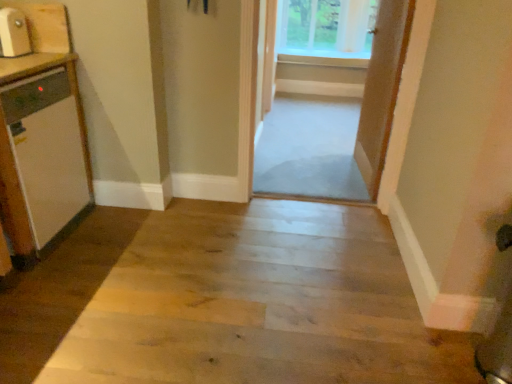
What do you see at coordinates (13, 33) in the screenshot? The width and height of the screenshot is (512, 384). I see `matte wood microwave at left, which appears as the 2th appliance when ordered from the bottom` at bounding box center [13, 33].

Identify the location of wooden floor at center. This screenshot has width=512, height=384. (259, 304).

What do you see at coordinates (259, 304) in the screenshot? This screenshot has height=384, width=512. I see `wooden floor at center` at bounding box center [259, 304].

The width and height of the screenshot is (512, 384). I want to click on wooden door at center, which is counted as the 2th door, starting from the right, so click(x=269, y=57).

Measure the distance between wooden door at center, arranged as the 1th door when viewed from the front, and camera.

wooden door at center, arranged as the 1th door when viewed from the front, and camera are 7.50 feet apart from each other.

At what (x,y) coordinates should I click in order to perform the action: click on clear glass window at upper center. Please return your answer as a coordinate pair (x, y). Looking at the image, I should click on point(326,30).

At what (x,y) coordinates should I click in order to perform the action: click on clear glass screen door at center. Please return your answer as a coordinate pair (x, y). Looking at the image, I should click on (334, 115).

Would you say wooden floor at center is a long distance from matte wood microwave at left, which appears as the 2th appliance when ordered from the bottom?

Yes.

How different are the orientations of wooden floor at center and matte wood microwave at left, which appears as the 2th appliance when ordered from the bottom, in degrees?

86.5 degrees.

Find the location of `the 2nd appliance behind when counting from the wooden floor at center`. the 2nd appliance behind when counting from the wooden floor at center is located at coordinates (13, 33).

Is point (24, 19) positioned in front of point (265, 18)?

Yes, it is in front of point (265, 18).

Is matte wood microwave at left, which appears as the 2th appliance when ordered from the bottom, touching wooden door at center, which is the 1th door in left-to-right order?

matte wood microwave at left, which appears as the 2th appliance when ordered from the bottom, and wooden door at center, which is the 1th door in left-to-right order, are not in contact.

Can you confirm if matte wood microwave at left, marked as the 1th appliance in a top-to-bottom arrangement, is shorter than wooden door at center, which is counted as the 2th door, starting from the right?

Yes.

From a real-world perspective, is matte wood microwave at left, marked as the 1th appliance in a top-to-bottom arrangement, located higher than wooden door at center, the second door positioned from the front?

Indeed, from a real-world perspective, matte wood microwave at left, marked as the 1th appliance in a top-to-bottom arrangement, stands above wooden door at center, the second door positioned from the front.

Is wooden door at center, arranged as the 1th door when viewed from the front, oriented away from white glossy dishwasher at left, positioned as the 1th appliance in bottom-to-top order?

No, wooden door at center, arranged as the 1th door when viewed from the front, is not facing away from white glossy dishwasher at left, positioned as the 1th appliance in bottom-to-top order.

Which is more to the left, wooden door at center, which is the 2th door from left to right, or white glossy dishwasher at left, positioned as the 1th appliance in bottom-to-top order?

white glossy dishwasher at left, positioned as the 1th appliance in bottom-to-top order, is more to the left.

Is wooden door at center, arranged as the 1th door when viewed from the front, completely or partially outside of white glossy dishwasher at left, positioned as the 1th appliance in bottom-to-top order?

wooden door at center, arranged as the 1th door when viewed from the front, is positioned outside white glossy dishwasher at left, positioned as the 1th appliance in bottom-to-top order.

This screenshot has height=384, width=512. Find the location of `the 2nd appliance counting from the left of the wooden door at center, the 1th door positioned from the right`. the 2nd appliance counting from the left of the wooden door at center, the 1th door positioned from the right is located at coordinates (47, 150).

From the image's perspective, which object appears higher, wooden door at center, the second door positioned from the front, or wooden door at center, arranged as the 1th door when viewed from the front?

wooden door at center, the second door positioned from the front, is shown above in the image.

Measure the distance from wooden door at center, which appears as the first door when viewed from the back, to wooden door at center, which is counted as the second door, starting from the back.

They are 3.74 feet apart.

Can you see wooden door at center, which is the 1th door in left-to-right order, touching wooden door at center, arranged as the 1th door when viewed from the front?

wooden door at center, which is the 1th door in left-to-right order, and wooden door at center, arranged as the 1th door when viewed from the front, are clearly separated.

Would you say wooden door at center, which is the 1th door in left-to-right order, is inside or outside wooden door at center, the 1th door positioned from the right?

wooden door at center, which is the 1th door in left-to-right order, cannot be found inside wooden door at center, the 1th door positioned from the right.

Is matte wood microwave at left, which appears as the 2th appliance when ordered from the bottom, closer to camera compared to clear glass screen door at center?

That is True.

Between matte wood microwave at left, which appears as the 2th appliance when ordered from the bottom, and clear glass screen door at center, which one has less height?

With less height is matte wood microwave at left, which appears as the 2th appliance when ordered from the bottom.

Is matte wood microwave at left, which appears as the 2th appliance when ordered from the bottom, far from clear glass screen door at center?

That's right, there is a large distance between matte wood microwave at left, which appears as the 2th appliance when ordered from the bottom, and clear glass screen door at center.

From a real-world perspective, is matte wood microwave at left, which appears as the 2th appliance when ordered from the bottom, below clear glass screen door at center?

Actually, matte wood microwave at left, which appears as the 2th appliance when ordered from the bottom, is physically above clear glass screen door at center in the real world.

Consider the image. Is white glossy dishwasher at left, which is the second appliance from top to bottom, oriented away from wooden floor at center?

That's not correct — white glossy dishwasher at left, which is the second appliance from top to bottom, is not looking away from wooden floor at center.

Is white glossy dishwasher at left, which is the second appliance from top to bottom, wider than wooden floor at center?

No, white glossy dishwasher at left, which is the second appliance from top to bottom, is not wider than wooden floor at center.

Identify the location of the 1st appliance positioned above the wooden floor at center (from a real-world perspective). This screenshot has width=512, height=384. (47, 150).

Is white glossy dishwasher at left, positioned as the 1th appliance in bottom-to-top order, next to matte wood microwave at left, which appears as the 2th appliance when ordered from the bottom?

There is a gap between white glossy dishwasher at left, positioned as the 1th appliance in bottom-to-top order, and matte wood microwave at left, which appears as the 2th appliance when ordered from the bottom.

Can you confirm if white glossy dishwasher at left, positioned as the 1th appliance in bottom-to-top order, is positioned to the right of matte wood microwave at left, which appears as the 2th appliance when ordered from the bottom?

No.

Consider the image. From the image's perspective, is white glossy dishwasher at left, which is the second appliance from top to bottom, beneath matte wood microwave at left, which appears as the 2th appliance when ordered from the bottom?

Yes.

Where is `path below the matte wood microwave at left, which appears as the 2th appliance when ordered from the bottom (from the image's perspective)`? This screenshot has height=384, width=512. path below the matte wood microwave at left, which appears as the 2th appliance when ordered from the bottom (from the image's perspective) is located at coordinates (259, 304).

Which door is the 2nd one when counting from the back of the matte wood microwave at left, which appears as the 2th appliance when ordered from the bottom? Please provide its 2D coordinates.

[(269, 57)]

From the image, which object appears to be farther from clear glass screen door at center, clear glass window at upper center or white glossy dishwasher at left, positioned as the 1th appliance in bottom-to-top order?

white glossy dishwasher at left, positioned as the 1th appliance in bottom-to-top order.

Which object lies nearer to the anchor point wooden floor at center, wooden door at center, which is counted as the 2th door, starting from the right, or wooden door at center, which is the 2th door from left to right?

wooden door at center, which is the 2th door from left to right, lies closer to wooden floor at center than the other object.

Looking at this image, based on their spatial positions, is white glossy dishwasher at left, which is the second appliance from top to bottom, or wooden floor at center closer to clear glass screen door at center?

wooden floor at center is positioned closer to the anchor clear glass screen door at center.

Considering their positions, is clear glass window at upper center positioned further to white glossy dishwasher at left, which is the second appliance from top to bottom, than wooden door at center, which is counted as the second door, starting from the back?

clear glass window at upper center is positioned further to the anchor white glossy dishwasher at left, which is the second appliance from top to bottom.

Looking at the image, which one is located further to wooden door at center, which appears as the first door when viewed from the back, white glossy dishwasher at left, which is the second appliance from top to bottom, or wooden floor at center?

wooden floor at center.

When comparing their distances from clear glass window at upper center, does wooden floor at center or clear glass screen door at center seem further?

wooden floor at center is further to clear glass window at upper center.

Considering their positions, is wooden door at center, the 1th door positioned from the right, positioned closer to matte wood microwave at left, which appears as the 2th appliance when ordered from the bottom, than white glossy dishwasher at left, positioned as the 1th appliance in bottom-to-top order?

white glossy dishwasher at left, positioned as the 1th appliance in bottom-to-top order, lies closer to matte wood microwave at left, which appears as the 2th appliance when ordered from the bottom, than the other object.

Estimate the real-world distances between objects in this image. Which object is further from clear glass screen door at center, wooden door at center, arranged as the 1th door when viewed from the front, or wooden floor at center?

wooden floor at center.

Where is `door situated between white glossy dishwasher at left, which is the second appliance from top to bottom, and clear glass screen door at center from left to right`? The image size is (512, 384). door situated between white glossy dishwasher at left, which is the second appliance from top to bottom, and clear glass screen door at center from left to right is located at coordinates (269, 57).

Find the location of `door located between white glossy dishwasher at left, positioned as the 1th appliance in bottom-to-top order, and wooden door at center, which is the 2th door from left to right, in the left-right direction`. door located between white glossy dishwasher at left, positioned as the 1th appliance in bottom-to-top order, and wooden door at center, which is the 2th door from left to right, in the left-right direction is located at coordinates (269, 57).

Identify the location of door between wooden floor at center and wooden door at center, the second door positioned from the front, in the front-back direction. The image size is (512, 384). (382, 89).

This screenshot has width=512, height=384. I want to click on path between white glossy dishwasher at left, which is the second appliance from top to bottom, and clear glass screen door at center from left to right, so click(x=259, y=304).